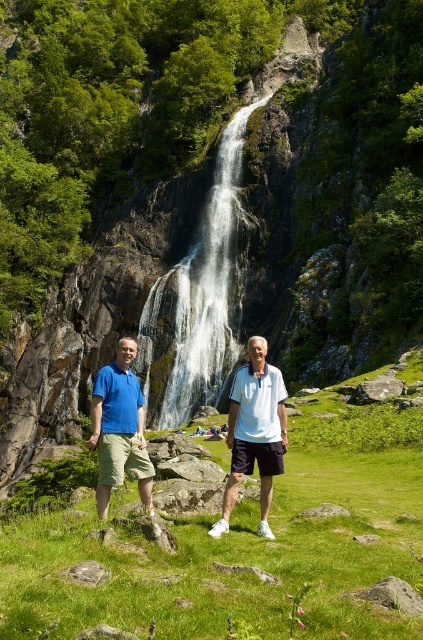
Is green grass at center above white/smooth waterfall at center?

Incorrect, green grass at center is not positioned above white/smooth waterfall at center.

Does green grass at center appear on the left side of white/smooth waterfall at center?

In fact, green grass at center is to the right of white/smooth waterfall at center.

Is point (373, 497) farther from viewer compared to point (208, 301)?

No, it is in front of (208, 301).

Identify the location of green grass at center. The width and height of the screenshot is (423, 640). (224, 557).

From the picture: Between blue cotton shirt at center and white matte shirt at center, which one appears on the right side from the viewer's perspective?

white matte shirt at center

Does blue cotton shirt at center appear under white matte shirt at center?

Incorrect, blue cotton shirt at center is not positioned below white matte shirt at center.

Locate an element on the screen. This screenshot has width=423, height=640. blue cotton shirt at center is located at coordinates (255, 432).

Identify the location of white/smooth waterfall at center. (198, 296).

Consider the image. Can you confirm if white/smooth waterfall at center is smaller than matte blue shirt at center?

Actually, white/smooth waterfall at center might be larger than matte blue shirt at center.

Image resolution: width=423 pixels, height=640 pixels. What are the coordinates of `white/smooth waterfall at center` in the screenshot? It's located at (198, 296).

Locate an element on the screen. white/smooth waterfall at center is located at coordinates (198, 296).